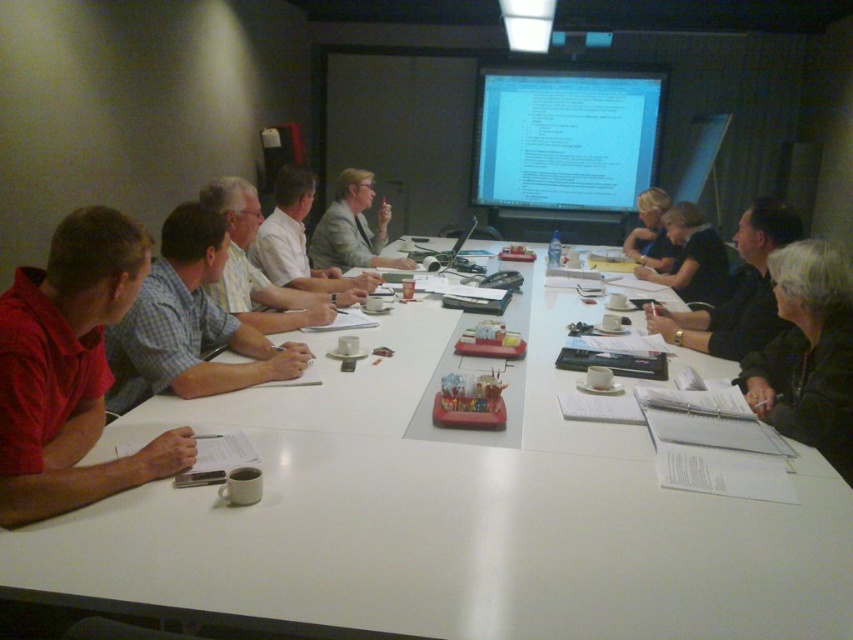
Question: Does white glossy projection screen at upper center have a larger size compared to checkered fabric shirt at left?

Choices:
 (A) no
 (B) yes

Answer: (B)

Question: Can you confirm if white glossy table at center is positioned below matte red shirt at left?

Choices:
 (A) no
 (B) yes

Answer: (B)

Question: Which of the following is the closest to the observer?

Choices:
 (A) white glossy projection screen at upper center
 (B) white glossy table at center
 (C) dark gray shirt at center
 (D) matte red shirt at left

Answer: (B)

Question: Does matte red shirt at left appear on the right side of checkered fabric shirt at left?

Choices:
 (A) no
 (B) yes

Answer: (A)

Question: Among these points, which one is nearest to the camera?

Choices:
 (A) (527, 140)
 (B) (19, 467)
 (C) (229, 180)
 (D) (207, 420)

Answer: (B)

Question: Based on their relative distances, which object is farther from the white glossy table at center?

Choices:
 (A) black shirt at right
 (B) matte red shirt at left
 (C) blonde hair at upper right
 (D) dark gray shirt at center

Answer: (C)